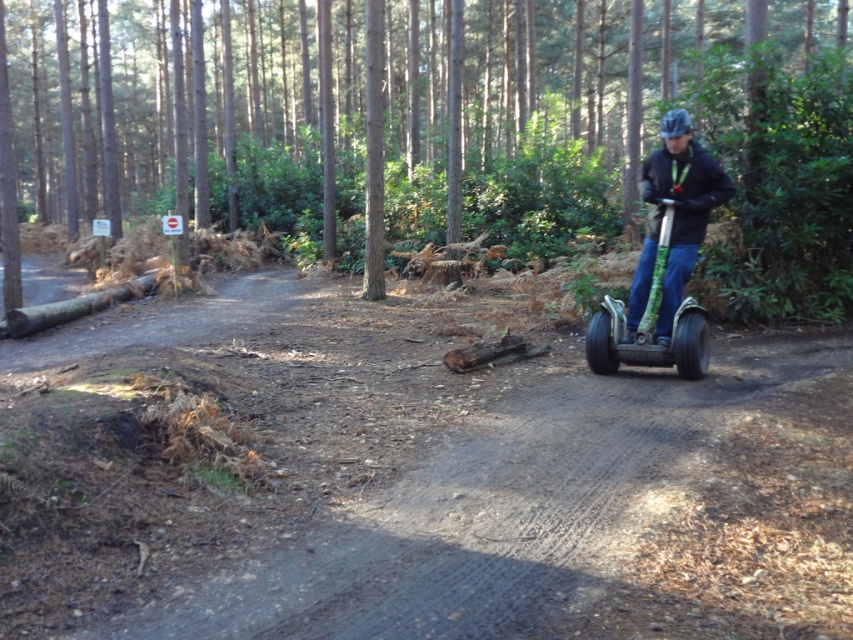
Is point (164, 332) positioned before point (654, 225)?

No, (164, 332) is further to viewer.

Between brown dirt track at center and green textured scooter at right, which one has less height?

With less height is brown dirt track at center.

Locate an element on the screen. brown dirt track at center is located at coordinates (416, 483).

Between brown dirt track at center and green textured log at center, which one appears on the left side from the viewer's perspective?

brown dirt track at center

Does brown dirt track at center have a larger size compared to green textured log at center?

Actually, brown dirt track at center might be smaller than green textured log at center.

Does point (27, 616) come closer to viewer compared to point (450, 232)?

Yes.

This screenshot has width=853, height=640. Find the location of `brown dirt track at center`. brown dirt track at center is located at coordinates (416, 483).

Who is lower down, green textured log at center or green textured segway at right?

green textured segway at right

I want to click on green textured log at center, so click(x=535, y=132).

Who is more distant from viewer, (393,58) or (596,353)?

Point (393,58)

The width and height of the screenshot is (853, 640). What are the coordinates of `green textured log at center` in the screenshot? It's located at (535, 132).